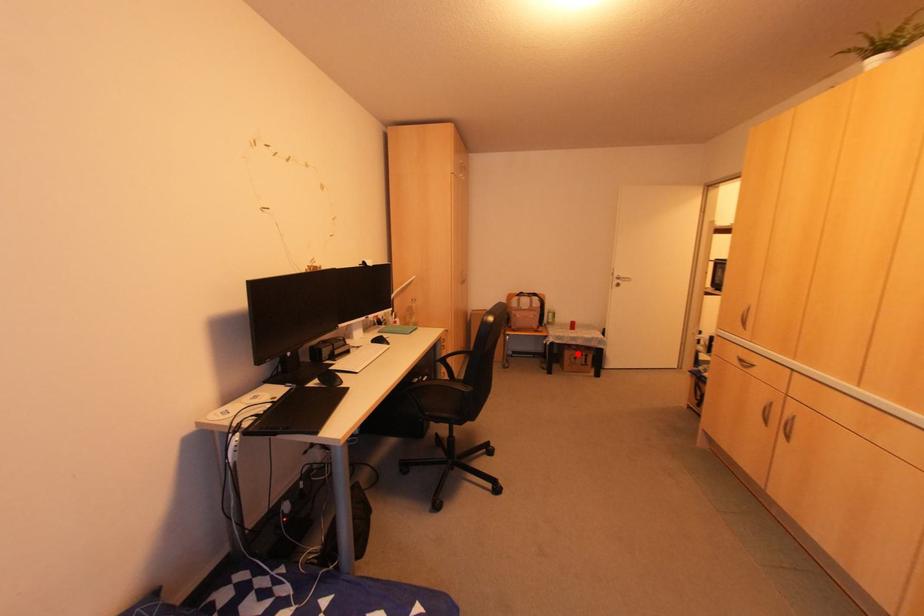
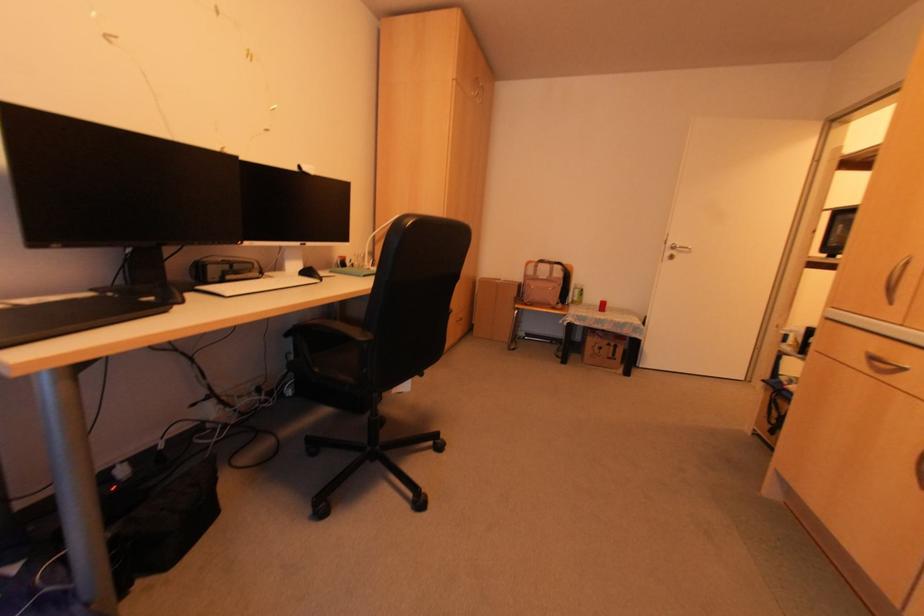
Question: I am providing you with two images of the same scene from different viewpoints. Image1 has a red point marked. In image2, the corresponding 3D location appears at what relative position? Reply with the corresponding letter.

Choices:
 (A) Closer
 (B) Farther

Answer: (A)